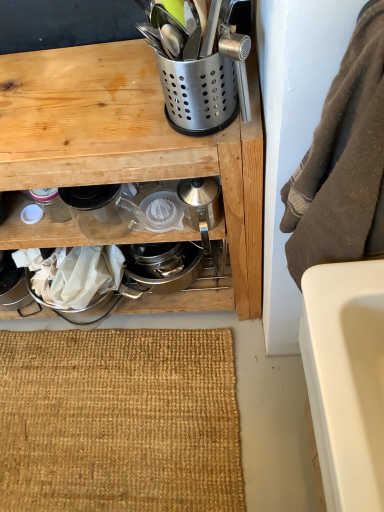
Question: Considering the positions of clear glass pitcher at center, the fourth appliance viewed from the right, and metallic silver utensil holder at upper center in the image, is clear glass pitcher at center, the fourth appliance viewed from the right, taller or shorter than metallic silver utensil holder at upper center?

Choices:
 (A) tall
 (B) short

Answer: (B)

Question: Considering their positions, is clear glass pitcher at center, arranged as the 2th appliance when viewed from the left, located in front of or behind metallic silver utensil holder at upper center?

Choices:
 (A) behind
 (B) front

Answer: (A)

Question: Estimate the real-world distances between objects in this image. Which object is closer to the satin silver utensil holder at upper center, which ranks as the 4th appliance in left-to-right order?

Choices:
 (A) clear glass pitcher at center, arranged as the 2th appliance when viewed from the left
 (B) burlap mat at lower center
 (C) brown fuzzy towel at right
 (D) matte glass jar at lower left, acting as the fifth appliance starting from the right
 (E) silver metallic kettle at center, marked as the fifth appliance in a left-to-right arrangement

Answer: (E)

Question: Considering the real-world distances, which object is closest to the satin silver utensil holder at upper center, which ranks as the 4th appliance in left-to-right order?

Choices:
 (A) clear glass pitcher at center, arranged as the 2th appliance when viewed from the left
 (B) metallic silver utensil holder at upper center
 (C) brown fuzzy towel at right
 (D) burlap mat at lower center
 (E) clear plastic juicer at center, the 3th appliance in the right-to-left sequence

Answer: (B)